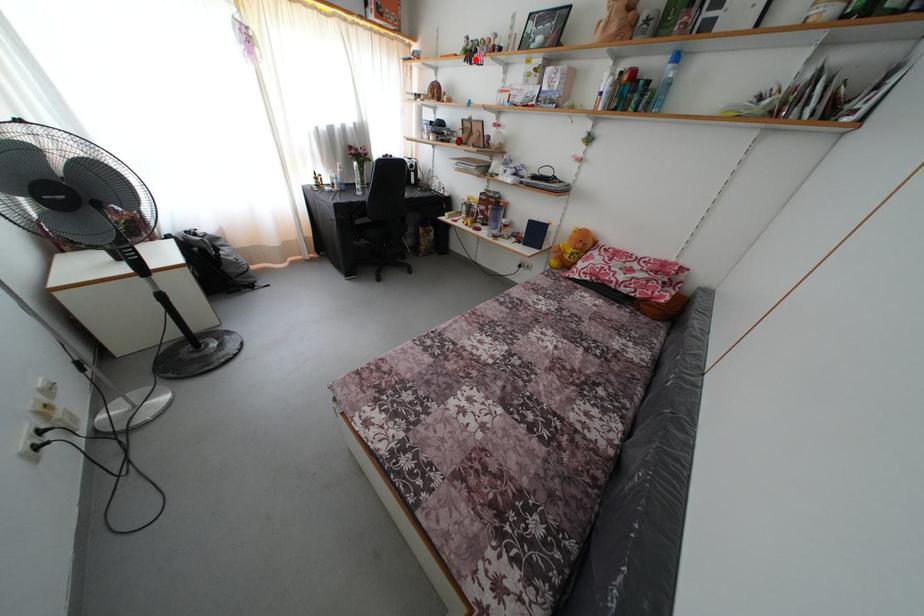
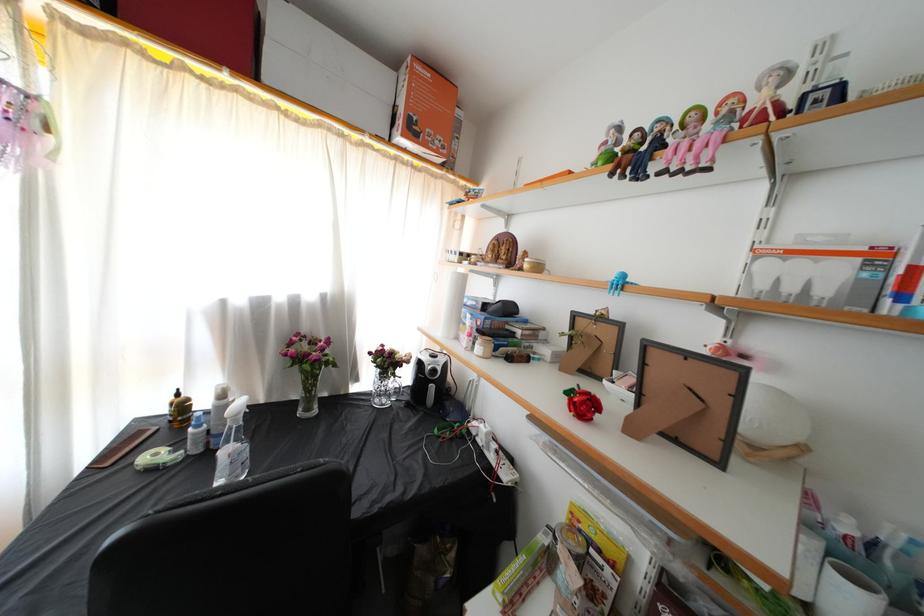
Find the pixel in the second image that matches the highlighted location in the first image.

(638, 161)